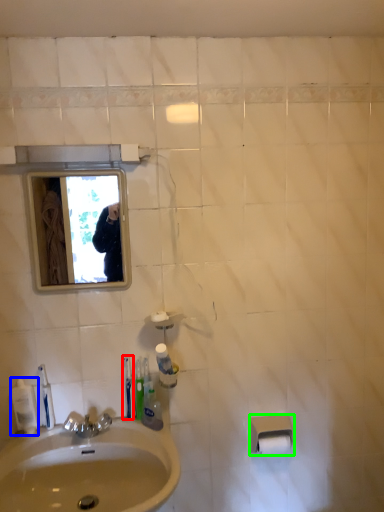
Question: Based on their relative distances, which object is nearer to toothbrush (highlighted by a red box)? Choose from mouthwash (highlighted by a blue box) and toilet paper (highlighted by a green box).

Choices:
 (A) mouthwash
 (B) toilet paper

Answer: (A)